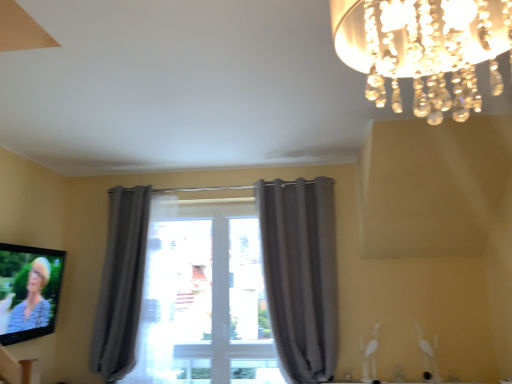
Identify the location of gray fabric curtain at left, positioned as the 1th curtain in left-to-right order. 121,284.

From the picture: Measure the distance between point (46, 312) and camera.

They are 2.91 meters apart.

What do you see at coordinates (32, 300) in the screenshot? I see `matte black tv at lower left` at bounding box center [32, 300].

The width and height of the screenshot is (512, 384). Describe the element at coordinates (422, 47) in the screenshot. I see `clear crystal chandelier at upper right` at that location.

The image size is (512, 384). In order to click on gray fabric curtain at center, which is the 2th curtain in left-to-right order in this screenshot , I will do `click(300, 275)`.

How many degrees apart are the facing directions of clear crystal chandelier at upper right and matte black tv at lower left?

The angle between the facing direction of clear crystal chandelier at upper right and the facing direction of matte black tv at lower left is 179 degrees.

Does clear crystal chandelier at upper right have a larger size compared to matte black tv at lower left?

Yes, clear crystal chandelier at upper right is bigger than matte black tv at lower left.

From the image's perspective, is clear crystal chandelier at upper right on matte black tv at lower left?

Yes, from the image's perspective, clear crystal chandelier at upper right is above matte black tv at lower left.

Image resolution: width=512 pixels, height=384 pixels. In order to click on lamp located on the right of matte black tv at lower left in this screenshot , I will do `click(422, 47)`.

From a real-world perspective, is clear crystal chandelier at upper right positioned under gray fabric curtain at center, the first curtain viewed from the right, based on gravity?

Incorrect, from a real-world perspective, clear crystal chandelier at upper right is higher than gray fabric curtain at center, the first curtain viewed from the right.

Is clear crystal chandelier at upper right next to gray fabric curtain at center, the first curtain viewed from the right, and touching it?

No, clear crystal chandelier at upper right is not touching gray fabric curtain at center, the first curtain viewed from the right.

From the picture: Is clear crystal chandelier at upper right outside of gray fabric curtain at center, the first curtain viewed from the right?

Yes, clear crystal chandelier at upper right is outside of gray fabric curtain at center, the first curtain viewed from the right.

How different are the orientations of clear crystal chandelier at upper right and gray fabric curtain at center, the first curtain viewed from the right, in degrees?

The angle between the facing direction of clear crystal chandelier at upper right and the facing direction of gray fabric curtain at center, the first curtain viewed from the right, is 85.2 degrees.

From a real-world perspective, is clear crystal chandelier at upper right on top of gray fabric curtain at left, positioned as the 1th curtain in left-to-right order?

A: Yes.

Between clear crystal chandelier at upper right and gray fabric curtain at left, positioned as the 1th curtain in left-to-right order, which one has less height?

Standing shorter between the two is clear crystal chandelier at upper right.

From the image's perspective, is clear crystal chandelier at upper right under gray fabric curtain at left, positioned as the 1th curtain in left-to-right order?

No, from the image's perspective, clear crystal chandelier at upper right is not beneath gray fabric curtain at left, positioned as the 1th curtain in left-to-right order.

You are a GUI agent. You are given a task and a screenshot of the screen. Output one action in this format:
    pyautogui.click(x=<x>, y=<y>)
    Task: Click on the 2nd curtain behind the clear crystal chandelier at upper right, starting your count from the anchor
    The width and height of the screenshot is (512, 384).
    Given the screenshot: What is the action you would take?
    pyautogui.click(x=121, y=284)

Is gray fabric curtain at center, the first curtain viewed from the right, facing towards clear crystal chandelier at upper right?

Yes, gray fabric curtain at center, the first curtain viewed from the right, is aimed at clear crystal chandelier at upper right.

Is gray fabric curtain at center, which is the 2th curtain in left-to-right order, outside of clear crystal chandelier at upper right?

gray fabric curtain at center, which is the 2th curtain in left-to-right order, is positioned outside clear crystal chandelier at upper right.

Measure the distance from gray fabric curtain at center, which is the 2th curtain in left-to-right order, to clear crystal chandelier at upper right.

They are 2.77 meters apart.

In terms of size, does gray fabric curtain at center, the first curtain viewed from the right, appear bigger or smaller than clear crystal chandelier at upper right?

Considering their sizes, gray fabric curtain at center, the first curtain viewed from the right, takes up more space than clear crystal chandelier at upper right.

Between matte black tv at lower left and gray fabric curtain at center, which is the 2th curtain in left-to-right order, which one has larger width?

Wider between the two is gray fabric curtain at center, which is the 2th curtain in left-to-right order.

Is matte black tv at lower left looking in the opposite direction of gray fabric curtain at center, the first curtain viewed from the right?

No, matte black tv at lower left is not facing away from gray fabric curtain at center, the first curtain viewed from the right.

From a real-world perspective, is matte black tv at lower left below gray fabric curtain at center, which is the 2th curtain in left-to-right order?

Yes, from a real-world perspective, matte black tv at lower left is beneath gray fabric curtain at center, which is the 2th curtain in left-to-right order.

From a real-world perspective, is gray fabric curtain at center, which is the 2th curtain in left-to-right order, located higher than gray fabric curtain at left, the second curtain viewed from the right?

Yes, from a real-world perspective, gray fabric curtain at center, which is the 2th curtain in left-to-right order, is above gray fabric curtain at left, the second curtain viewed from the right.

Considering the points (294, 360) and (122, 365), which point is in front, point (294, 360) or point (122, 365)?

The point (294, 360) is in front.

Can we say gray fabric curtain at center, the first curtain viewed from the right, lies outside gray fabric curtain at left, positioned as the 1th curtain in left-to-right order?

Indeed, gray fabric curtain at center, the first curtain viewed from the right, is completely outside gray fabric curtain at left, positioned as the 1th curtain in left-to-right order.

Could you tell me if gray fabric curtain at left, positioned as the 1th curtain in left-to-right order, is turned towards matte black tv at lower left?

No, gray fabric curtain at left, positioned as the 1th curtain in left-to-right order, is not oriented towards matte black tv at lower left.

Based on their positions, is gray fabric curtain at left, the second curtain viewed from the right, located to the left or right of matte black tv at lower left?

gray fabric curtain at left, the second curtain viewed from the right, is to the right of matte black tv at lower left.

Is gray fabric curtain at left, positioned as the 1th curtain in left-to-right order, far away from matte black tv at lower left?

Actually, gray fabric curtain at left, positioned as the 1th curtain in left-to-right order, and matte black tv at lower left are a little close together.

The image size is (512, 384). I want to click on lamp above the matte black tv at lower left (from a real-world perspective), so click(422, 47).

At what (x,y) coordinates should I click in order to perform the action: click on the 1st curtain located beneath the clear crystal chandelier at upper right (from a real-world perspective). Please return your answer as a coordinate pair (x, y). Looking at the image, I should click on (300, 275).

From the image, which object appears to be farther from matte black tv at lower left, gray fabric curtain at center, which is the 2th curtain in left-to-right order, or gray fabric curtain at left, the second curtain viewed from the right?

gray fabric curtain at center, which is the 2th curtain in left-to-right order, lies further to matte black tv at lower left than the other object.

When comparing their distances from gray fabric curtain at center, which is the 2th curtain in left-to-right order, does clear crystal chandelier at upper right or gray fabric curtain at left, positioned as the 1th curtain in left-to-right order, seem further?

clear crystal chandelier at upper right.

Looking at this image, looking at the image, which one is located further to gray fabric curtain at center, which is the 2th curtain in left-to-right order, clear crystal chandelier at upper right or matte black tv at lower left?

clear crystal chandelier at upper right is positioned further to the anchor gray fabric curtain at center, which is the 2th curtain in left-to-right order.

Considering their positions, is clear crystal chandelier at upper right positioned further to gray fabric curtain at left, positioned as the 1th curtain in left-to-right order, than matte black tv at lower left?

The object further to gray fabric curtain at left, positioned as the 1th curtain in left-to-right order, is clear crystal chandelier at upper right.

From the image, which object appears to be farther from gray fabric curtain at center, which is the 2th curtain in left-to-right order, matte black tv at lower left or clear crystal chandelier at upper right?

clear crystal chandelier at upper right is positioned further to the anchor gray fabric curtain at center, which is the 2th curtain in left-to-right order.

Estimate the real-world distances between objects in this image. Which object is closer to gray fabric curtain at left, the second curtain viewed from the right, clear crystal chandelier at upper right or gray fabric curtain at center, which is the 2th curtain in left-to-right order?

Among the two, gray fabric curtain at center, which is the 2th curtain in left-to-right order, is located nearer to gray fabric curtain at left, the second curtain viewed from the right.

When comparing their distances from matte black tv at lower left, does clear crystal chandelier at upper right or gray fabric curtain at left, positioned as the 1th curtain in left-to-right order, seem closer?

gray fabric curtain at left, positioned as the 1th curtain in left-to-right order.

From the image, which object appears to be nearer to gray fabric curtain at left, the second curtain viewed from the right, gray fabric curtain at center, which is the 2th curtain in left-to-right order, or clear crystal chandelier at upper right?

Based on the image, gray fabric curtain at center, which is the 2th curtain in left-to-right order, appears to be nearer to gray fabric curtain at left, the second curtain viewed from the right.

Find the location of a particular element. curtain located between clear crystal chandelier at upper right and gray fabric curtain at left, the second curtain viewed from the right, in the depth direction is located at coordinates (300, 275).

Identify the location of person between clear crystal chandelier at upper right and gray fabric curtain at left, the second curtain viewed from the right, from front to back. (32, 300).

You are a GUI agent. You are given a task and a screenshot of the screen. Output one action in this format:
    pyautogui.click(x=<x>, y=<y>)
    Task: Click on the curtain between matte black tv at lower left and gray fabric curtain at center, the first curtain viewed from the right
    
    Given the screenshot: What is the action you would take?
    pyautogui.click(x=121, y=284)

Where is `person between clear crystal chandelier at upper right and gray fabric curtain at center, which is the 2th curtain in left-to-right order, in the front-back direction`? person between clear crystal chandelier at upper right and gray fabric curtain at center, which is the 2th curtain in left-to-right order, in the front-back direction is located at coordinates (32, 300).